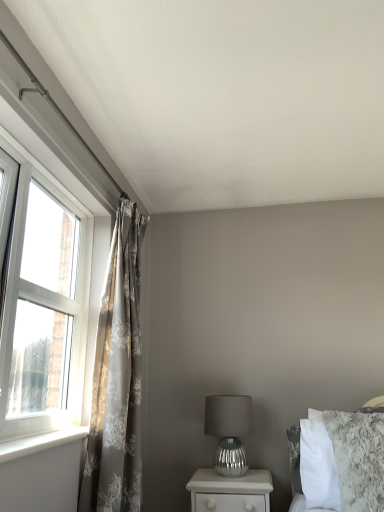
Question: From a real-world perspective, is white fluffy bed at upper right over white plastic window at left?

Choices:
 (A) yes
 (B) no

Answer: (B)

Question: Does white fluffy bed at upper right have a greater height compared to white plastic window at left?

Choices:
 (A) yes
 (B) no

Answer: (B)

Question: Is white fluffy bed at upper right not within white plastic window at left?

Choices:
 (A) no
 (B) yes

Answer: (B)

Question: Are white fluffy bed at upper right and white plastic window at left making contact?

Choices:
 (A) no
 (B) yes

Answer: (A)

Question: Is white fluffy bed at upper right positioned far away from white plastic window at left?

Choices:
 (A) no
 (B) yes

Answer: (B)

Question: In terms of width, does silver metallic nightstand at lower center look wider or thinner when compared to white plastic window at left?

Choices:
 (A) wide
 (B) thin

Answer: (A)

Question: Based on their positions, is silver metallic nightstand at lower center located to the left or right of white plastic window at left?

Choices:
 (A) right
 (B) left

Answer: (A)

Question: Do you think silver metallic nightstand at lower center is within white plastic window at left, or outside of it?

Choices:
 (A) inside
 (B) outside

Answer: (B)

Question: Considering the positions of point (225, 492) and point (79, 212), is point (225, 492) closer or farther from the camera than point (79, 212)?

Choices:
 (A) closer
 (B) farther

Answer: (B)

Question: Considering the positions of silver metallic table lamp at center and silver metallic nightstand at lower center in the image, is silver metallic table lamp at center taller or shorter than silver metallic nightstand at lower center?

Choices:
 (A) short
 (B) tall

Answer: (B)

Question: From a real-world perspective, is silver metallic table lamp at center physically located above or below silver metallic nightstand at lower center?

Choices:
 (A) below
 (B) above

Answer: (B)

Question: In terms of size, does silver metallic table lamp at center appear bigger or smaller than silver metallic nightstand at lower center?

Choices:
 (A) big
 (B) small

Answer: (B)

Question: Relative to silver metallic nightstand at lower center, is silver metallic table lamp at center in front or behind?

Choices:
 (A) behind
 (B) front

Answer: (A)

Question: Is silver metallic nightstand at lower center bigger or smaller than white plastic window sill at left?

Choices:
 (A) big
 (B) small

Answer: (A)

Question: Choose the correct answer: Is silver metallic nightstand at lower center inside white plastic window sill at left or outside it?

Choices:
 (A) inside
 (B) outside

Answer: (B)